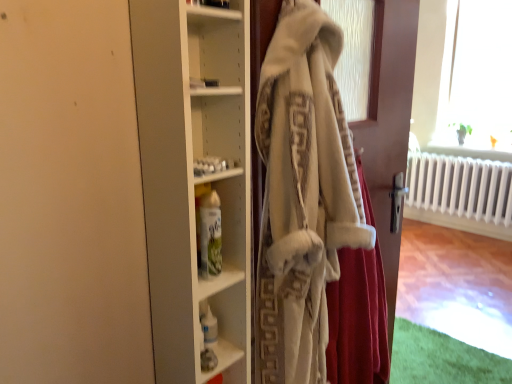
Question: Is fuzzy white shawl at center facing away from white fluffy bathrobe at center?

Choices:
 (A) no
 (B) yes

Answer: (B)

Question: Could you tell me if fuzzy white shawl at center is facing white fluffy bathrobe at center?

Choices:
 (A) yes
 (B) no

Answer: (A)

Question: Is fuzzy white shawl at center at the left side of white fluffy bathrobe at center?

Choices:
 (A) yes
 (B) no

Answer: (B)

Question: Is fuzzy white shawl at center outside of white fluffy bathrobe at center?

Choices:
 (A) no
 (B) yes

Answer: (A)

Question: Does fuzzy white shawl at center have a larger size compared to white fluffy bathrobe at center?

Choices:
 (A) yes
 (B) no

Answer: (B)

Question: In the image, is white plastic bottle at lower center, which is the 1th shelf in back-to-front order, on the left side or the right side of fuzzy white shawl at center?

Choices:
 (A) right
 (B) left

Answer: (B)

Question: Choose the correct answer: Is white plastic bottle at lower center, which is the second shelf in front-to-back order, inside fuzzy white shawl at center or outside it?

Choices:
 (A) inside
 (B) outside

Answer: (B)

Question: In terms of size, does white plastic bottle at lower center, which is the 1th shelf in back-to-front order, appear bigger or smaller than fuzzy white shawl at center?

Choices:
 (A) big
 (B) small

Answer: (B)

Question: From the image's perspective, is white plastic bottle at lower center, which is the 1th shelf in back-to-front order, positioned above or below fuzzy white shawl at center?

Choices:
 (A) above
 (B) below

Answer: (B)

Question: Considering the relative positions of white plastic bottle at lower center, which is the second shelf in front-to-back order, and white glossy spray can at center, acting as the 2th shelf starting from the bottom, in the image provided, is white plastic bottle at lower center, which is the second shelf in front-to-back order, to the left or to the right of white glossy spray can at center, acting as the 2th shelf starting from the bottom,?

Choices:
 (A) right
 (B) left

Answer: (A)

Question: Is point (218, 354) closer or farther from the camera than point (209, 190)?

Choices:
 (A) farther
 (B) closer

Answer: (A)

Question: Considering the positions of white plastic bottle at lower center, which is the 1th shelf from bottom to top, and white glossy spray can at center, positioned as the second shelf in back-to-front order, in the image, is white plastic bottle at lower center, which is the 1th shelf from bottom to top, wider or thinner than white glossy spray can at center, positioned as the second shelf in back-to-front order,?

Choices:
 (A) wide
 (B) thin

Answer: (A)

Question: In terms of height, does white plastic bottle at lower center, which is the 1th shelf in back-to-front order, look taller or shorter compared to white glossy spray can at center, acting as the 2th shelf starting from the bottom?

Choices:
 (A) tall
 (B) short

Answer: (A)

Question: Is white fluffy bathrobe at center inside or outside of white glossy spray can at center, marked as the 1th shelf in a top-to-bottom arrangement?

Choices:
 (A) outside
 (B) inside

Answer: (A)

Question: Is white fluffy bathrobe at center bigger or smaller than white glossy spray can at center, marked as the 1th shelf in a top-to-bottom arrangement?

Choices:
 (A) big
 (B) small

Answer: (A)